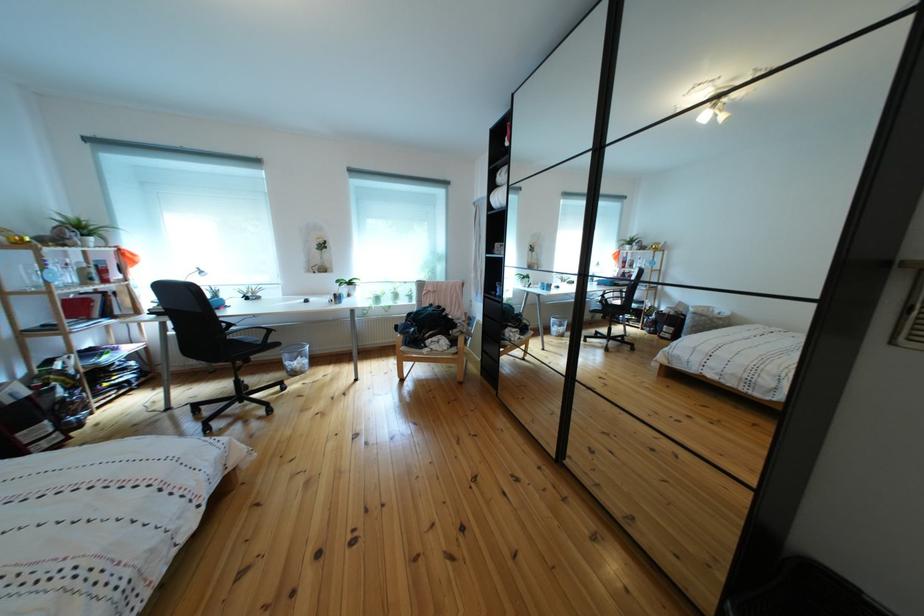
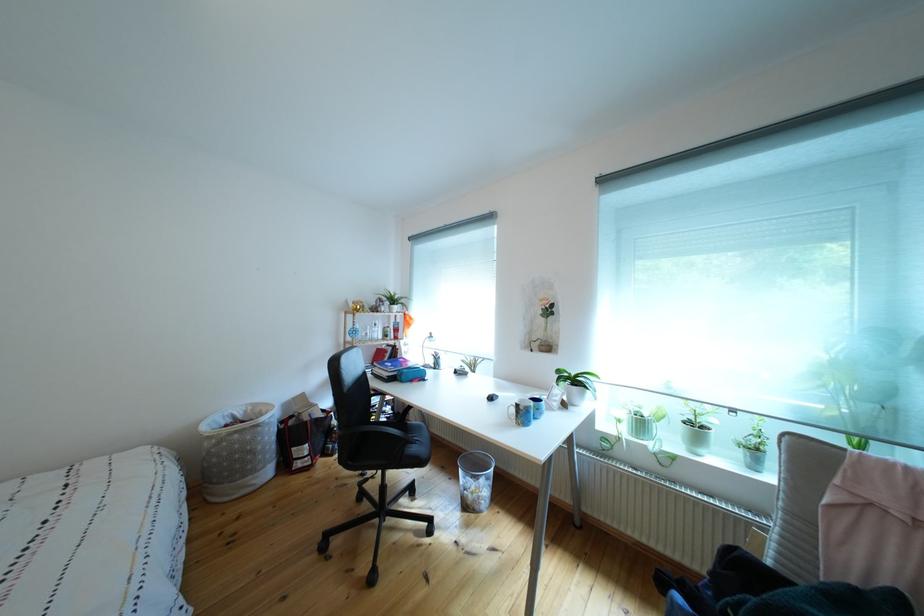
The point at (346, 301) is marked in the first image. Where is the corresponding point in the second image?

(529, 411)